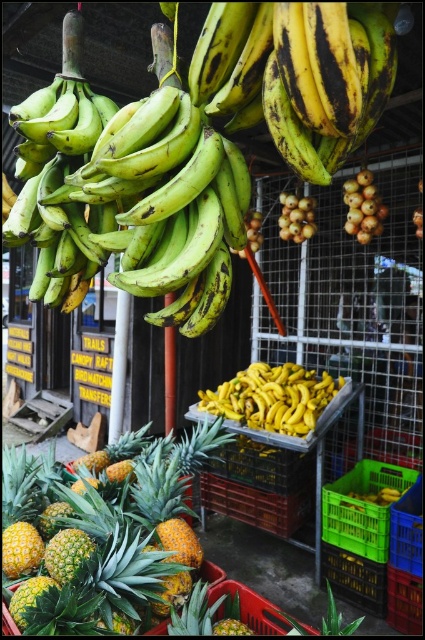
You are a customer standing at the market entrance and want to pick up both the yellow spiky pineapple at center and the smooth brown onion at center right. Which item will you reach first if you move directly toward them?

The yellow spiky pineapple at center will be reached first because it is closer to the viewer than the smooth brown onion at center right.

You are a customer at the fruit market. You want to find the yellow spiky pineapple at center. Where should you look in the market scene?

The yellow spiky pineapple at center is located at point 0.838 on the horizontal axis and 0.242 on the vertical axis.